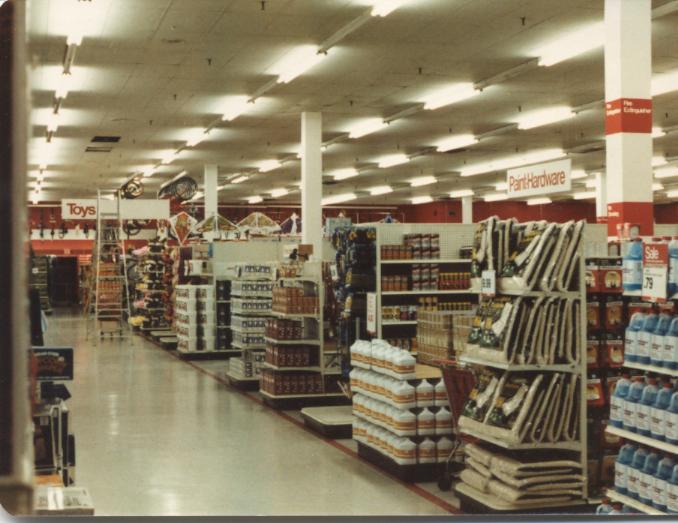
At what (x,y) coordinates should I click in order to perform the action: click on ladder. Please return your answer as a coordinate pair (x, y). Looking at the image, I should click on (121, 227).